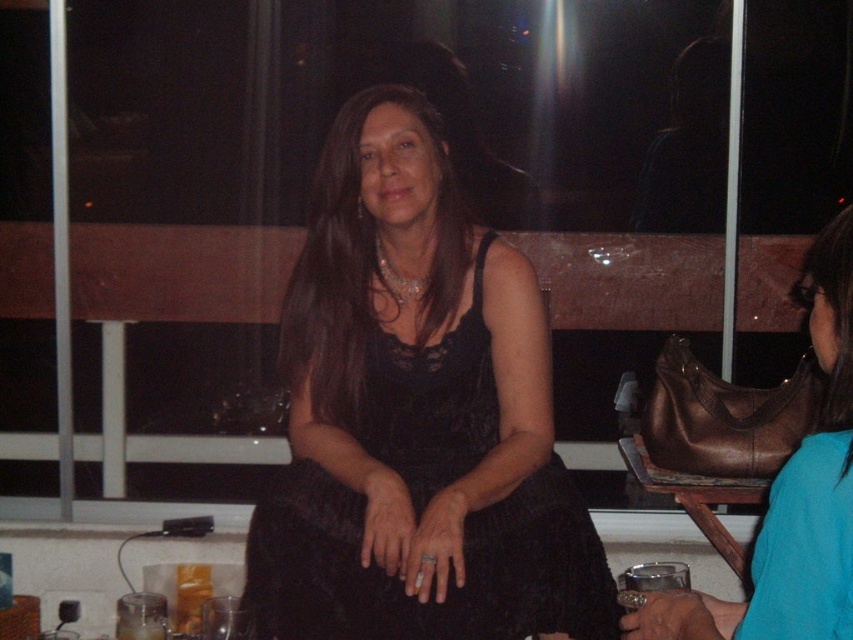
You are a photographer at the event and want to capture a photo of the woman in the black lace dress at center without including the transparent glass at lower right in the frame. Based on their positions, is this possible?

The black lace dress at center is to the left of the transparent glass at lower right, so if you position the camera to focus on the left side of the scene, you can capture the woman in the black lace dress at center without including the transparent glass at lower right in the frame.

From the picture: You are taking a photo of the scene and want to focus on both point (x=369, y=632) and point (x=688, y=570). Which point should you adjust your focus to first to ensure both are in focus?

Point (x=369, y=632) is closer to the camera than point (x=688, y=570). To ensure both are in focus, focus on point (x=369, y=632) first since it is closer, and adjust the depth of field accordingly.

You are a photographer standing in the scene and want to take a portrait of the black lace dress at center. What is the minimum distance you need to maintain to ensure the entire dress fits in the frame?

The minimum distance to maintain is 1.72 meters to ensure the entire black lace dress at center fits in the frame.